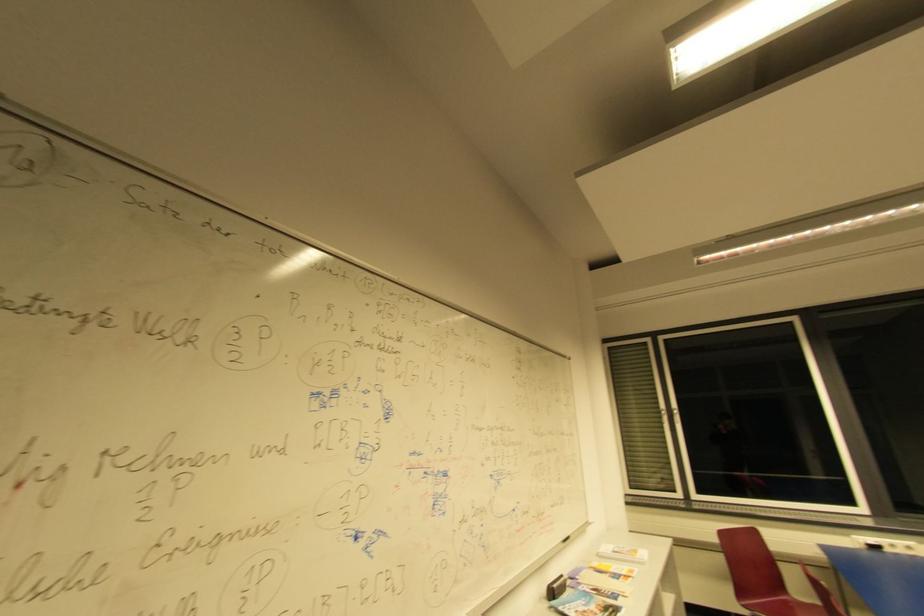
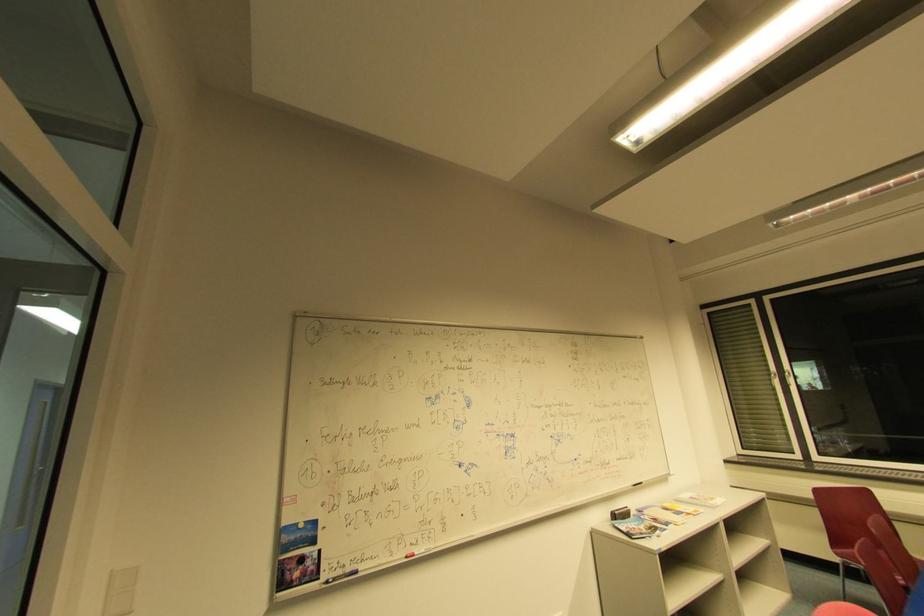
Find the pixel in the second image that matches pixel 678 413 in the first image.

(791, 375)